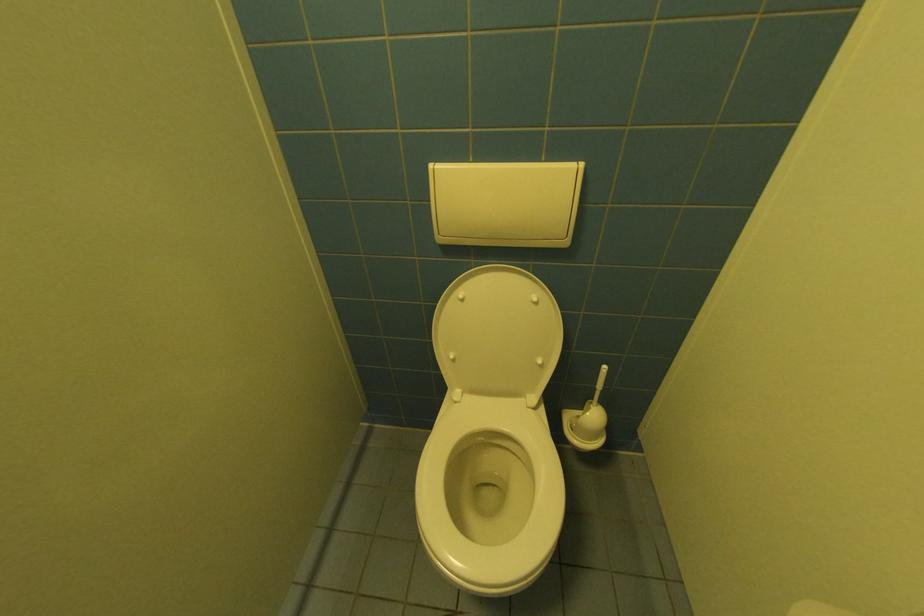
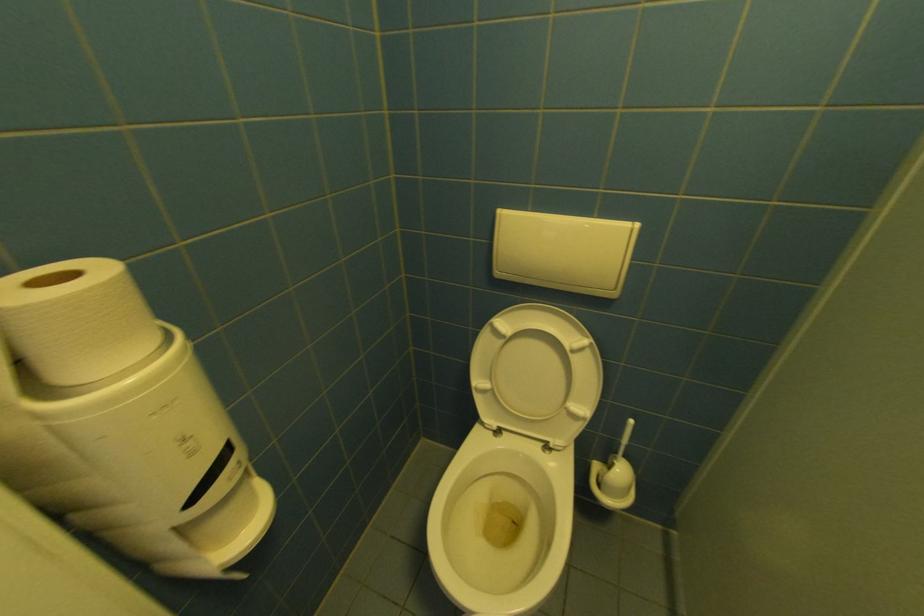
Question: How did the camera likely rotate?

Choices:
 (A) Left
 (B) Right
 (C) Up
 (D) Down

Answer: (A)